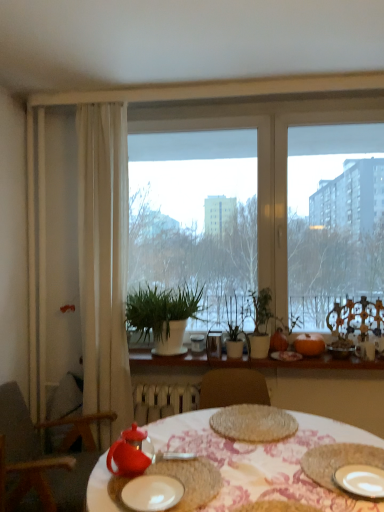
Question: Considering the positions of point (137, 291) and point (296, 430), is point (137, 291) closer or farther from the camera than point (296, 430)?

Choices:
 (A) farther
 (B) closer

Answer: (A)

Question: Is white matte plant pot at center in front of or behind woven mat at center in the image?

Choices:
 (A) behind
 (B) front

Answer: (A)

Question: Estimate the real-world distances between objects in this image. Which object is closer to the white sheer curtain at left?

Choices:
 (A) wooden chair at left
 (B) orange matte pumpkin at right
 (C) white matte plate at center, marked as the first plate in a left-to-right arrangement
 (D) matte red teapot at lower left
 (E) white ceramic plate at lower right, the second plate positioned from the left

Answer: (A)

Question: Which object is positioned farthest from the green matte plant at center?

Choices:
 (A) rustic woven placemat at lower right
 (B) transparent glass window at center
 (C) orange matte pumpkin at right
 (D) white ceramic plants at center
 (E) white matte plate at center, the 2th plate viewed from the right

Answer: (E)